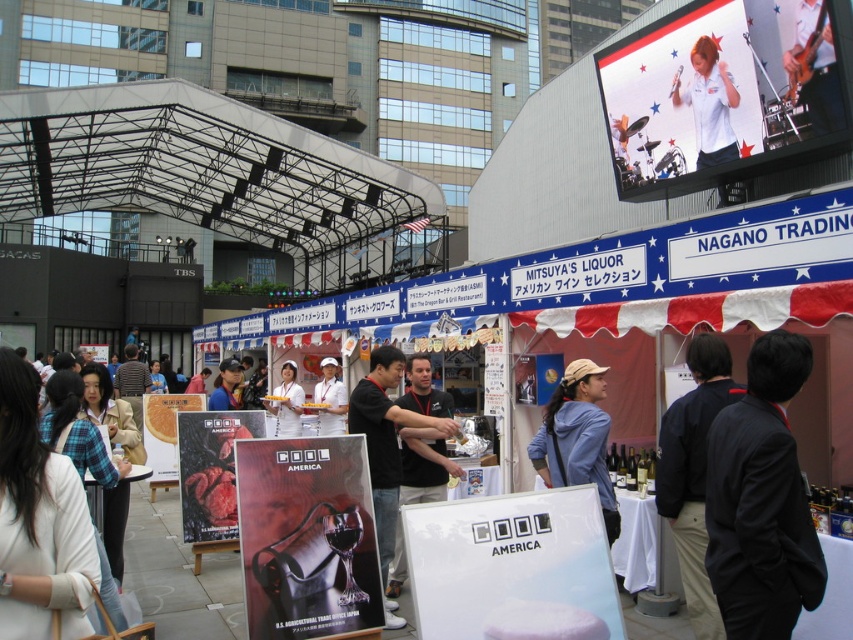
Question: Is wooden signboard at center wider than matte red poster at center?

Choices:
 (A) yes
 (B) no

Answer: (A)

Question: From the image, what is the correct spatial relationship of blue denim jacket at center in relation to matte red poster at center?

Choices:
 (A) right
 (B) left

Answer: (A)

Question: Is black shirt at center wider than white matte cap at center?

Choices:
 (A) yes
 (B) no

Answer: (A)

Question: Which point appears closest to the camera in this image?

Choices:
 (A) (386, 468)
 (B) (213, 528)
 (C) (363, 609)

Answer: (C)

Question: Which is nearer to the dark blue suit at center?

Choices:
 (A) white matte cap at center
 (B) dark blue fabric jacket at right
 (C) white smooth shirt at upper center

Answer: (B)

Question: Which point is closer to the camera?

Choices:
 (A) matte white shirt at upper right
 (B) blue denim jacket at center

Answer: (B)